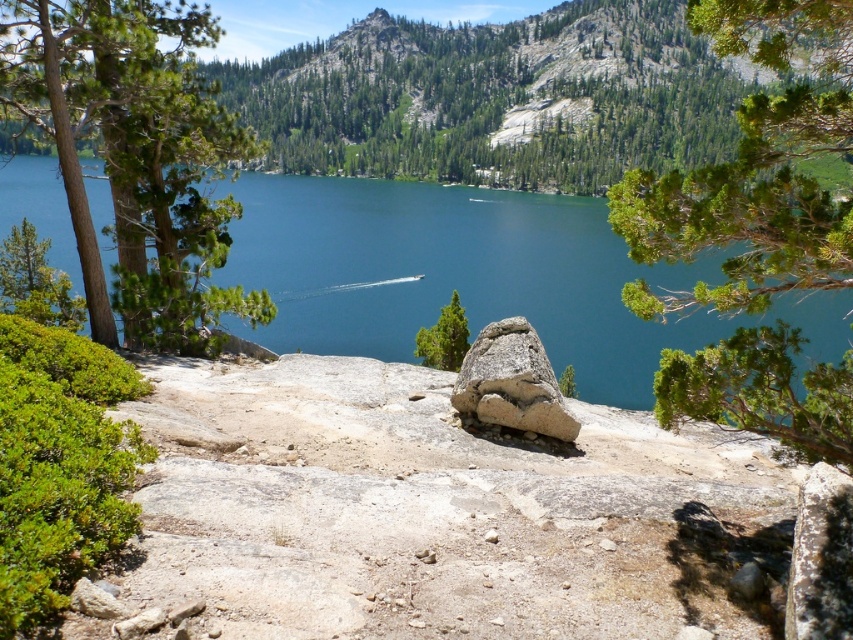
Does green leafy tree at upper center have a larger size compared to green textured tree at left?

Yes.

Who is more forward, [793,444] or [138,86]?

Positioned in front is point [793,444].

Locate an element on the screen. Image resolution: width=853 pixels, height=640 pixels. green leafy tree at upper center is located at coordinates [755, 170].

Based on the photo, is green leafy tree at upper center positioned behind green textured rock at center?

No, it is not.

Does green leafy tree at upper center have a lesser height compared to green textured rock at center?

Incorrect, green leafy tree at upper center's height does not fall short of green textured rock at center's.

You are a GUI agent. You are given a task and a screenshot of the screen. Output one action in this format:
    pyautogui.click(x=<x>, y=<y>)
    Task: Click on the green leafy tree at upper center
    Image resolution: width=853 pixels, height=640 pixels.
    Given the screenshot: What is the action you would take?
    pyautogui.click(x=755, y=170)

Locate an element on the screen. green leafy tree at upper center is located at coordinates (755, 170).

You are a GUI agent. You are given a task and a screenshot of the screen. Output one action in this format:
    pyautogui.click(x=<x>, y=<y>)
    Task: Click on the blue-green water at center
    Image resolution: width=853 pixels, height=640 pixels.
    Given the screenshot: What is the action you would take?
    pyautogui.click(x=473, y=276)

What do you see at coordinates (473, 276) in the screenshot? I see `blue-green water at center` at bounding box center [473, 276].

Where is `blue-green water at center`? Image resolution: width=853 pixels, height=640 pixels. blue-green water at center is located at coordinates (473, 276).